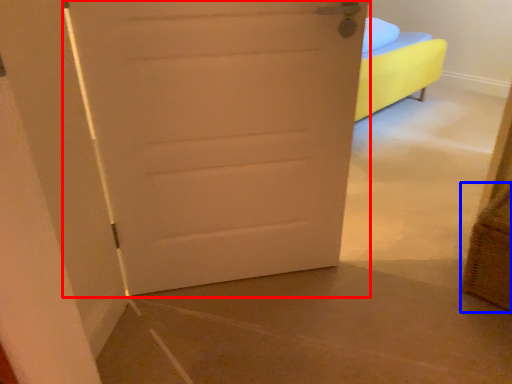
Question: Among these objects, which one is farthest to the camera, door (highlighted by a red box) or basket (highlighted by a blue box)?

Choices:
 (A) door
 (B) basket

Answer: (B)